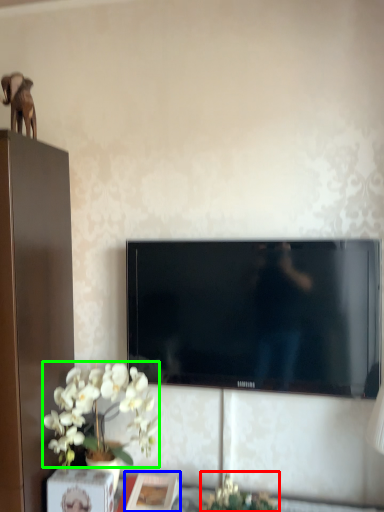
Question: Considering the real-world distances, which object is closest to plant (highlighted by a red box)? picture frame (highlighted by a blue box) or flower (highlighted by a green box).

Choices:
 (A) picture frame
 (B) flower

Answer: (A)